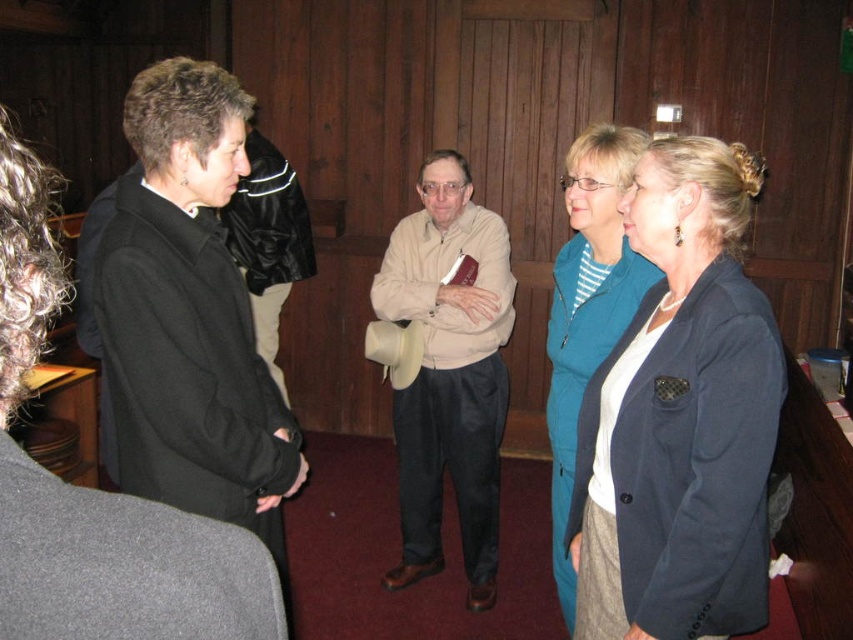
Question: Considering the real-world distances, which object is farthest from the teal fabric jacket at center?

Choices:
 (A) navy blue blazer at center
 (B) black woolen jacket at left

Answer: (B)

Question: In this image, where is black woolen jacket at left located relative to beige fabric sweater at center?

Choices:
 (A) right
 (B) left

Answer: (B)

Question: In this image, where is navy blue blazer at center located relative to teal fabric jacket at center?

Choices:
 (A) left
 (B) right

Answer: (B)

Question: Based on their relative distances, which object is farther from the beige fabric sweater at center?

Choices:
 (A) black woolen jacket at left
 (B) teal fabric jacket at center
 (C) navy blue blazer at center

Answer: (C)

Question: Which of these objects is positioned closest to the black woolen jacket at left?

Choices:
 (A) teal fabric jacket at center
 (B) navy blue blazer at center

Answer: (B)

Question: Is navy blue blazer at center bigger than teal fabric jacket at center?

Choices:
 (A) yes
 (B) no

Answer: (B)